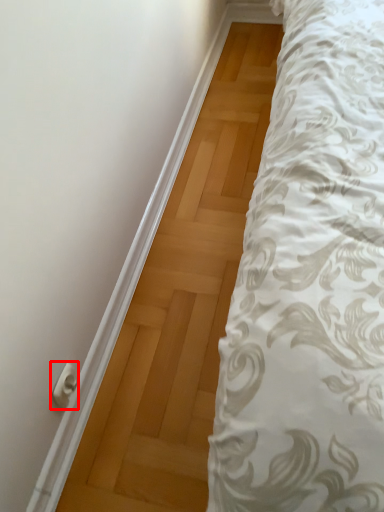
Question: Considering the relative positions of door handle (annotated by the red box) and door in the image provided, where is door handle (annotated by the red box) located with respect to the staircase?

Choices:
 (A) left
 (B) right

Answer: (A)